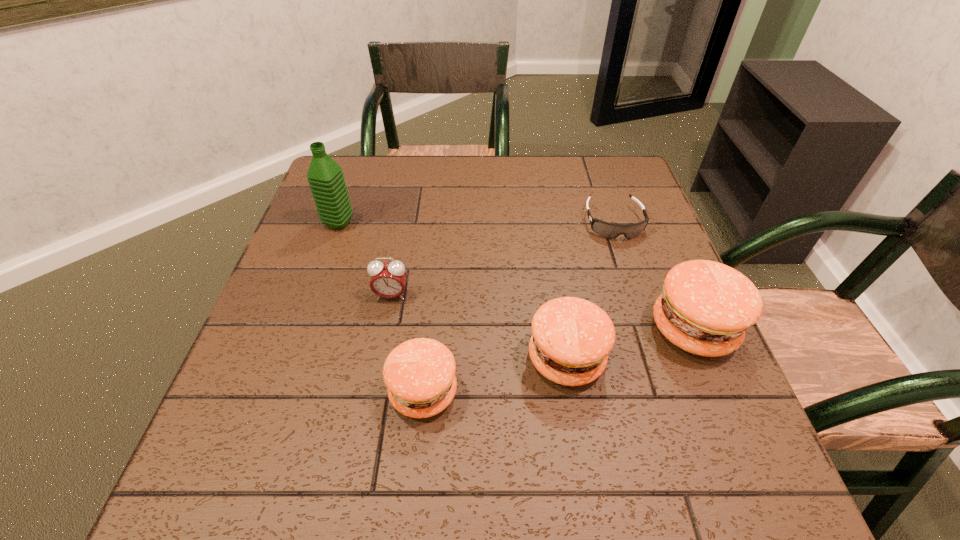
Locate an element on the screen. The height and width of the screenshot is (540, 960). vacant space at the right edge of the desktop is located at coordinates (621, 203).

What are the coordinates of `vacant area at the far left corner` in the screenshot? It's located at (365, 188).

I want to click on free space between the goggles and the fourth object from left to right, so click(590, 291).

Find the location of a particular element. Image resolution: width=960 pixels, height=540 pixels. empty space between the second patty from left to right and the shortest patty is located at coordinates (494, 375).

Identify the location of free spot between the shortest patty and the leftmost object. Image resolution: width=960 pixels, height=540 pixels. click(381, 307).

The image size is (960, 540). I want to click on vacant space in between the rightmost patty and the goggles, so click(x=654, y=275).

Find the location of a particular element. This screenshot has height=540, width=960. free spot between the alarm clock and the goggles is located at coordinates (503, 259).

What are the coordinates of `vacant area that lies between the alarm clock and the leftmost object` in the screenshot? It's located at (365, 259).

At what (x,y) coordinates should I click in order to perform the action: click on blank region between the alarm clock and the leftmost object. Please return your answer as a coordinate pair (x, y). This screenshot has width=960, height=540. Looking at the image, I should click on (365, 259).

Where is `the closest object to the shortest object`? The height and width of the screenshot is (540, 960). the closest object to the shortest object is located at coordinates (705, 308).